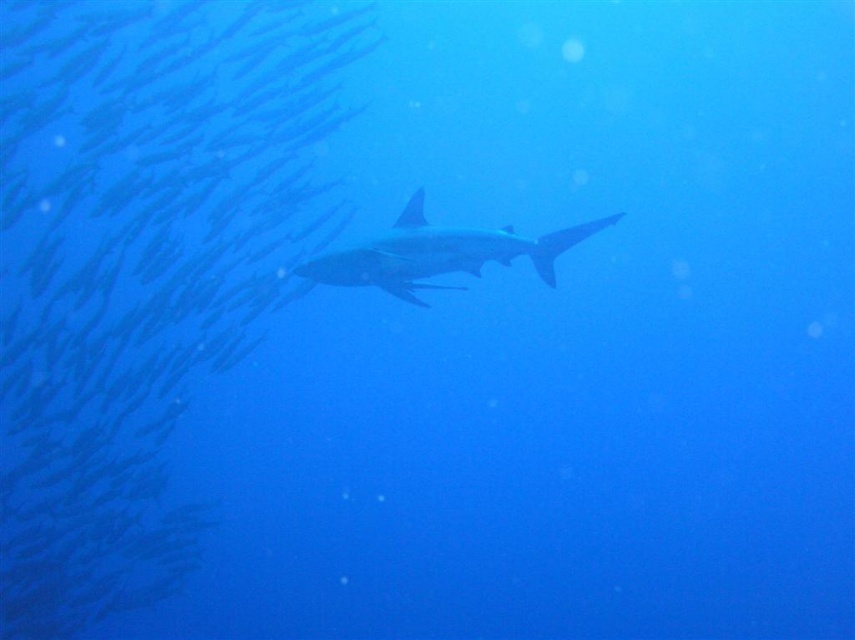
Question: Which point is closer to the camera?

Choices:
 (A) (133, 132)
 (B) (387, 234)

Answer: (B)

Question: Which point appears closest to the camera in this image?

Choices:
 (A) (175, 508)
 (B) (453, 244)

Answer: (B)

Question: Which point is closer to the camera?

Choices:
 (A) smooth gray shark at center
 (B) translucent blue fish at upper left

Answer: (A)

Question: Is translucent blue fish at upper left thinner than smooth gray shark at center?

Choices:
 (A) no
 (B) yes

Answer: (A)

Question: Is translucent blue fish at upper left closer to the viewer compared to smooth gray shark at center?

Choices:
 (A) yes
 (B) no

Answer: (B)

Question: Observing the image, what is the correct spatial positioning of translucent blue fish at upper left in reference to smooth gray shark at center?

Choices:
 (A) below
 (B) above

Answer: (B)